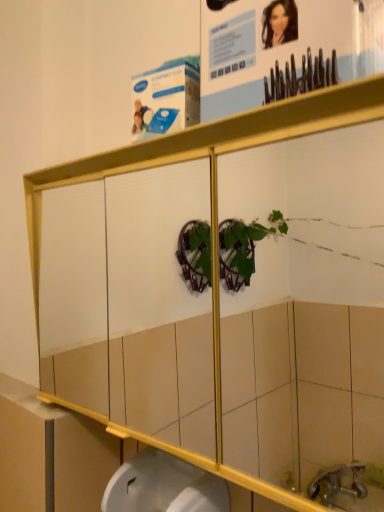
The height and width of the screenshot is (512, 384). What are the coordinates of `white glossy sink at lower center` in the screenshot? It's located at (164, 486).

Describe the element at coordinates (164, 486) in the screenshot. I see `white glossy sink at lower center` at that location.

Image resolution: width=384 pixels, height=512 pixels. In order to click on white glossy sink at lower center in this screenshot , I will do `click(164, 486)`.